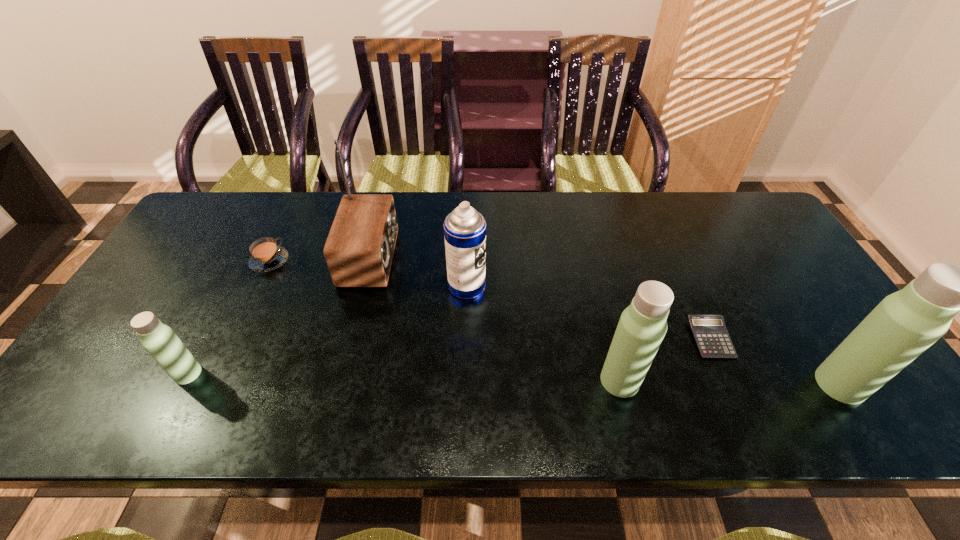
The height and width of the screenshot is (540, 960). Identify the location of object that is positioned at the near right corner. (904, 324).

Identify the location of vacant region at the far edge. (433, 237).

Where is `vacant region at the near edge of the desktop`? vacant region at the near edge of the desktop is located at coordinates (322, 383).

In the image, there is a desktop. Where is `vacant space at the left edge`? vacant space at the left edge is located at coordinates (204, 283).

Find the location of a particular element. The width and height of the screenshot is (960, 540). vacant space at the right edge is located at coordinates (821, 322).

The image size is (960, 540). In the image, there is a desktop. What are the coordinates of `vacant area at the far right corner` in the screenshot? It's located at (723, 224).

Locate an element on the screen. The image size is (960, 540). empty space between the leftmost thermos bottle and the fifth object from right to left is located at coordinates (279, 315).

Identify the location of vacant space in between the third shortest object and the fourth object from left to right. (327, 330).

In order to click on free space between the radio receiver and the fourth object from left to right in this screenshot , I will do tap(419, 272).

Where is `free space between the second tallest thermos bottle and the aerosol can`? This screenshot has height=540, width=960. free space between the second tallest thermos bottle and the aerosol can is located at coordinates (543, 333).